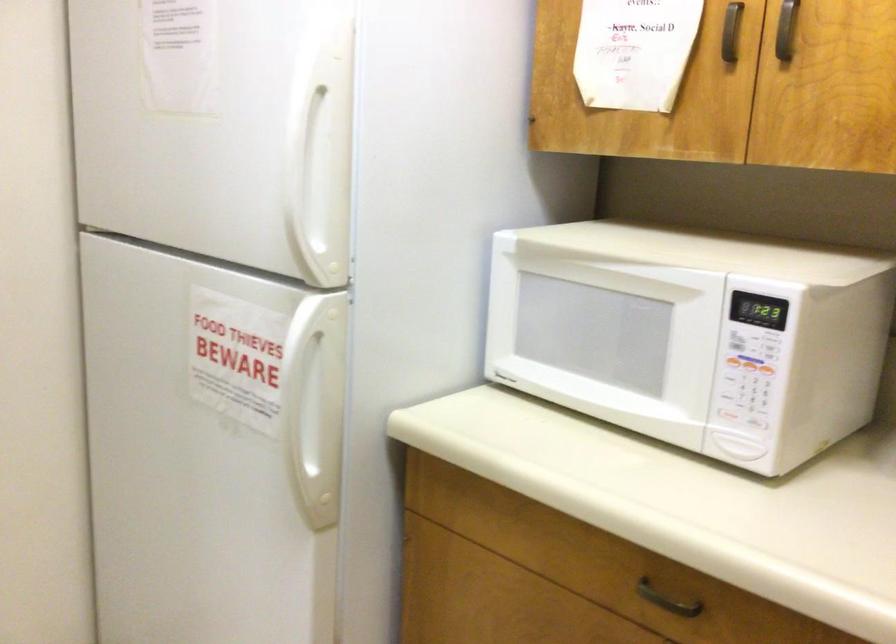
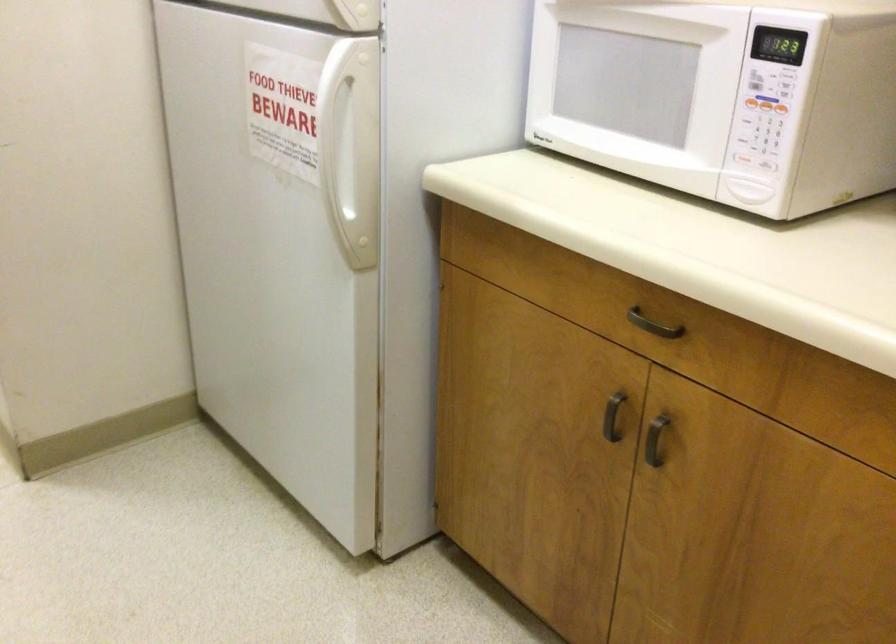
Locate, in the second image, the point that corresponds to [729,413] in the first image.

(741, 158)